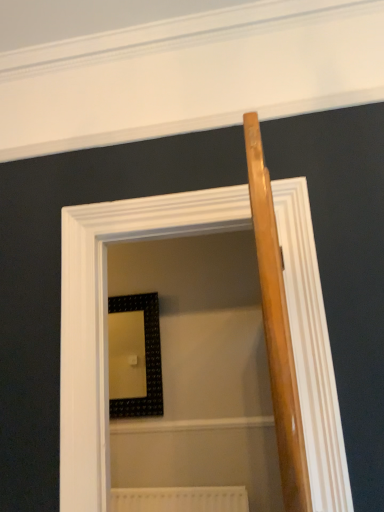
Question: Is black textured picture frame at center placed right next to wooden screen door at center?

Choices:
 (A) no
 (B) yes

Answer: (A)

Question: Is black textured picture frame at center not near wooden screen door at center?

Choices:
 (A) no
 (B) yes

Answer: (B)

Question: From a real-world perspective, is black textured picture frame at center on top of wooden screen door at center?

Choices:
 (A) yes
 (B) no

Answer: (A)

Question: Considering the relative sizes of black textured picture frame at center and wooden screen door at center in the image provided, is black textured picture frame at center taller than wooden screen door at center?

Choices:
 (A) no
 (B) yes

Answer: (A)

Question: From a real-world perspective, is black textured picture frame at center below wooden screen door at center?

Choices:
 (A) yes
 (B) no

Answer: (B)

Question: Would you say black textured picture frame at center is to the left or to the right of wooden screen door at center in the picture?

Choices:
 (A) right
 (B) left

Answer: (B)

Question: Looking at their shapes, would you say black textured picture frame at center is wider or thinner than wooden screen door at center?

Choices:
 (A) thin
 (B) wide

Answer: (A)

Question: From a real-world perspective, relative to wooden screen door at center, is black textured picture frame at center vertically above or below?

Choices:
 (A) above
 (B) below

Answer: (A)

Question: From the image's perspective, relative to wooden screen door at center, is black textured picture frame at center above or below?

Choices:
 (A) below
 (B) above

Answer: (A)

Question: Choose the correct answer: Is black textured picture frame at center inside white textured radiator at lower center or outside it?

Choices:
 (A) inside
 (B) outside

Answer: (B)

Question: In terms of width, does black textured picture frame at center look wider or thinner when compared to white textured radiator at lower center?

Choices:
 (A) wide
 (B) thin

Answer: (A)

Question: Considering their positions, is black textured picture frame at center located in front of or behind white textured radiator at lower center?

Choices:
 (A) behind
 (B) front

Answer: (A)

Question: Is point (109, 311) closer or farther from the camera than point (190, 488)?

Choices:
 (A) closer
 (B) farther

Answer: (B)

Question: Is wooden screen door at center taller or shorter than black textured picture frame at center?

Choices:
 (A) tall
 (B) short

Answer: (A)

Question: From a real-world perspective, is wooden screen door at center above or below black textured picture frame at center?

Choices:
 (A) below
 (B) above

Answer: (A)